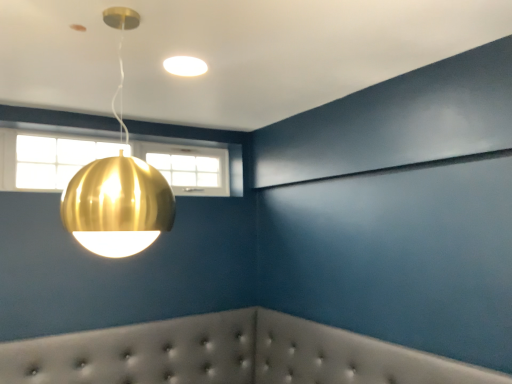
Where is `free point above gold metallic sphere at upper center, which appears as the first lamp when viewed from the front (from a real-world perspective)`? The height and width of the screenshot is (384, 512). free point above gold metallic sphere at upper center, which appears as the first lamp when viewed from the front (from a real-world perspective) is located at coordinates (116, 15).